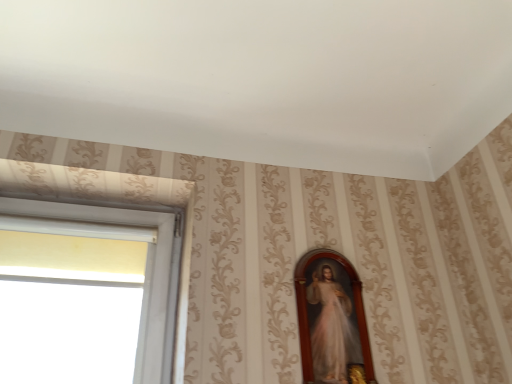
What do you see at coordinates (331, 319) in the screenshot?
I see `wooden frame at upper center` at bounding box center [331, 319].

Where is `wooden frame at upper center`? The height and width of the screenshot is (384, 512). wooden frame at upper center is located at coordinates (331, 319).

Identify the location of wooden frame at upper center. (331, 319).